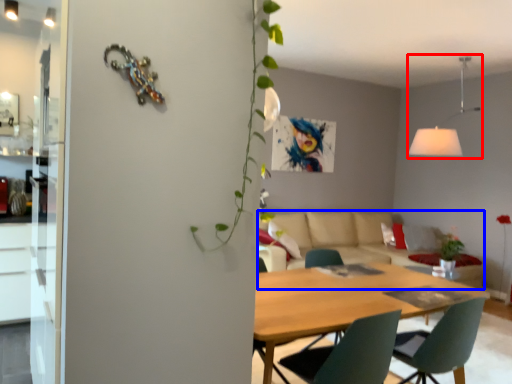
Question: Which of the following is the closest to the observer, light fixture (highlighted by a red box) or couch (highlighted by a blue box)?

Choices:
 (A) light fixture
 (B) couch

Answer: (B)